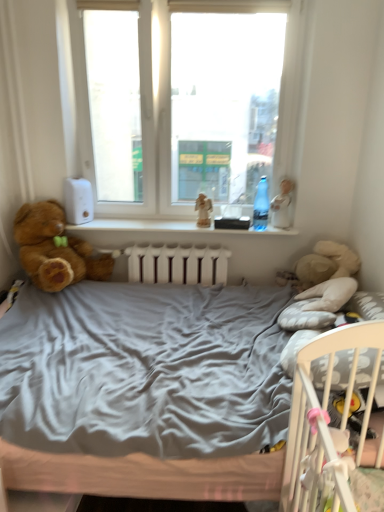
Question: Is brown plush teddy bear at left shorter than white plastic window sill at center?

Choices:
 (A) yes
 (B) no

Answer: (B)

Question: Considering the relative sizes of brown plush teddy bear at left and white plastic window sill at center in the image provided, is brown plush teddy bear at left taller than white plastic window sill at center?

Choices:
 (A) no
 (B) yes

Answer: (B)

Question: Is brown plush teddy bear at left turned away from white plastic window sill at center?

Choices:
 (A) no
 (B) yes

Answer: (A)

Question: Is brown plush teddy bear at left next to white plastic window sill at center?

Choices:
 (A) yes
 (B) no

Answer: (B)

Question: Does brown plush teddy bear at left have a greater width compared to white plastic window sill at center?

Choices:
 (A) yes
 (B) no

Answer: (A)

Question: Considering the relative positions of white porcelain doll at upper right and brown plush teddy bear at left in the image provided, is white porcelain doll at upper right to the left or to the right of brown plush teddy bear at left?

Choices:
 (A) left
 (B) right

Answer: (B)

Question: Does point (286, 202) appear closer or farther from the camera than point (49, 226)?

Choices:
 (A) closer
 (B) farther

Answer: (B)

Question: From a real-world perspective, relative to brown plush teddy bear at left, is white porcelain doll at upper right vertically above or below?

Choices:
 (A) below
 (B) above

Answer: (B)

Question: Is white porcelain doll at upper right in front of or behind brown plush teddy bear at left in the image?

Choices:
 (A) behind
 (B) front

Answer: (A)

Question: From the image's perspective, relative to white plastic window sill at center, is brown plush teddy bear at left above or below?

Choices:
 (A) below
 (B) above

Answer: (A)

Question: Is brown plush teddy bear at left bigger or smaller than white plastic window sill at center?

Choices:
 (A) big
 (B) small

Answer: (A)

Question: Looking at their shapes, would you say brown plush teddy bear at left is wider or thinner than white plastic window sill at center?

Choices:
 (A) wide
 (B) thin

Answer: (A)

Question: Relative to white plastic window sill at center, is brown plush teddy bear at left in front or behind?

Choices:
 (A) behind
 (B) front

Answer: (B)

Question: Is transparent plastic bottle at window wider or thinner than transparent glass window at center?

Choices:
 (A) thin
 (B) wide

Answer: (A)

Question: From a real-world perspective, relative to transparent glass window at center, is transparent plastic bottle at window vertically above or below?

Choices:
 (A) above
 (B) below

Answer: (B)